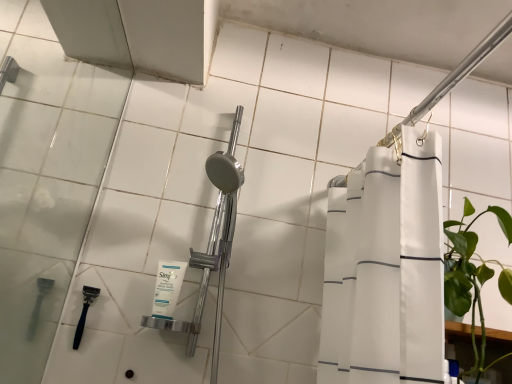
Question: Is white matte facial cleanser at center directly adjacent to black plastic razor at lower left, positioned as the second shower in front-to-back order?

Choices:
 (A) no
 (B) yes

Answer: (A)

Question: Considering the relative sizes of white matte facial cleanser at center and black plastic razor at lower left, which ranks as the 2th shower in top-to-bottom order, in the image provided, is white matte facial cleanser at center smaller than black plastic razor at lower left, which ranks as the 2th shower in top-to-bottom order,?

Choices:
 (A) yes
 (B) no

Answer: (B)

Question: Can black plastic razor at lower left, which ranks as the 2th shower in top-to-bottom order, be found inside white matte facial cleanser at center?

Choices:
 (A) no
 (B) yes

Answer: (A)

Question: Considering the relative positions of white matte facial cleanser at center and black plastic razor at lower left, which ranks as the 2th shower in top-to-bottom order, in the image provided, is white matte facial cleanser at center behind black plastic razor at lower left, which ranks as the 2th shower in top-to-bottom order,?

Choices:
 (A) yes
 (B) no

Answer: (B)

Question: Are white matte facial cleanser at center and black plastic razor at lower left, positioned as the second shower in front-to-back order, far apart?

Choices:
 (A) no
 (B) yes

Answer: (A)

Question: In terms of width, does black plastic razor at lower left, positioned as the first shower in left-to-right order, look wider or thinner when compared to white matte facial cleanser at center?

Choices:
 (A) thin
 (B) wide

Answer: (A)

Question: Does point (77, 332) appear closer or farther from the camera than point (162, 274)?

Choices:
 (A) farther
 (B) closer

Answer: (B)

Question: Is black plastic razor at lower left, which ranks as the 2th shower in top-to-bottom order, situated inside white matte facial cleanser at center or outside?

Choices:
 (A) inside
 (B) outside

Answer: (B)

Question: Looking at the image, does black plastic razor at lower left, positioned as the first shower in left-to-right order, seem bigger or smaller compared to white matte facial cleanser at center?

Choices:
 (A) big
 (B) small

Answer: (B)

Question: Considering the positions of black plastic razor at lower left, which ranks as the 2th shower in top-to-bottom order, and white fabric shower curtain at upper right, arranged as the second shower when viewed from the back, in the image, is black plastic razor at lower left, which ranks as the 2th shower in top-to-bottom order, wider or thinner than white fabric shower curtain at upper right, arranged as the second shower when viewed from the back,?

Choices:
 (A) wide
 (B) thin

Answer: (B)

Question: Considering the positions of black plastic razor at lower left, positioned as the second shower in front-to-back order, and white fabric shower curtain at upper right, which ranks as the first shower in right-to-left order, in the image, is black plastic razor at lower left, positioned as the second shower in front-to-back order, taller or shorter than white fabric shower curtain at upper right, which ranks as the first shower in right-to-left order,?

Choices:
 (A) tall
 (B) short

Answer: (A)

Question: From the image's perspective, is black plastic razor at lower left, positioned as the first shower in left-to-right order, located above or below white fabric shower curtain at upper right, arranged as the second shower when viewed from the back?

Choices:
 (A) above
 (B) below

Answer: (B)

Question: Is black plastic razor at lower left, positioned as the second shower in front-to-back order, in front of or behind white fabric shower curtain at upper right, placed as the 1th shower when sorted from front to back, in the image?

Choices:
 (A) behind
 (B) front

Answer: (A)

Question: From the image's perspective, is white matte facial cleanser at center positioned above or below white fabric shower curtain at upper right, which ranks as the first shower in right-to-left order?

Choices:
 (A) above
 (B) below

Answer: (B)

Question: Based on their sizes in the image, would you say white matte facial cleanser at center is bigger or smaller than white fabric shower curtain at upper right, which ranks as the first shower in right-to-left order?

Choices:
 (A) small
 (B) big

Answer: (A)